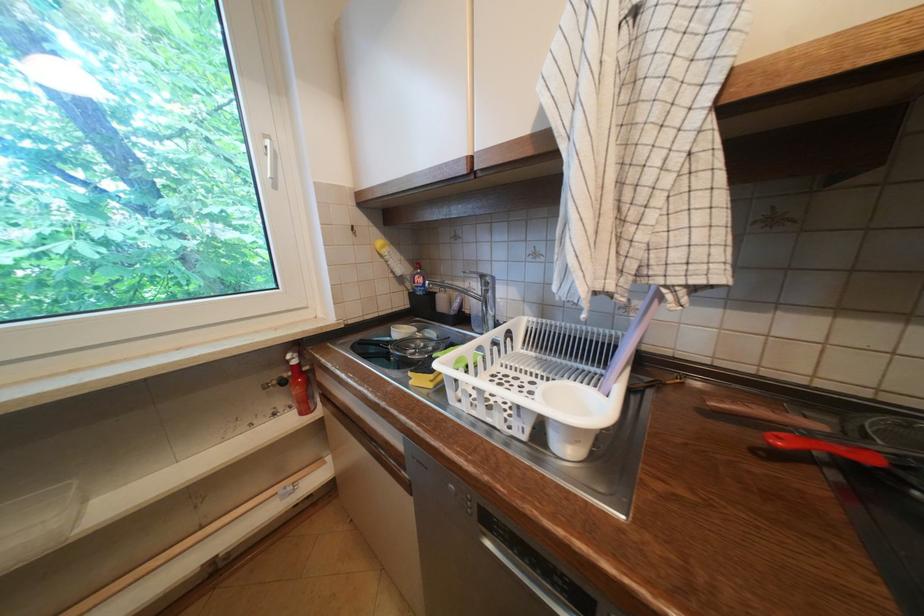
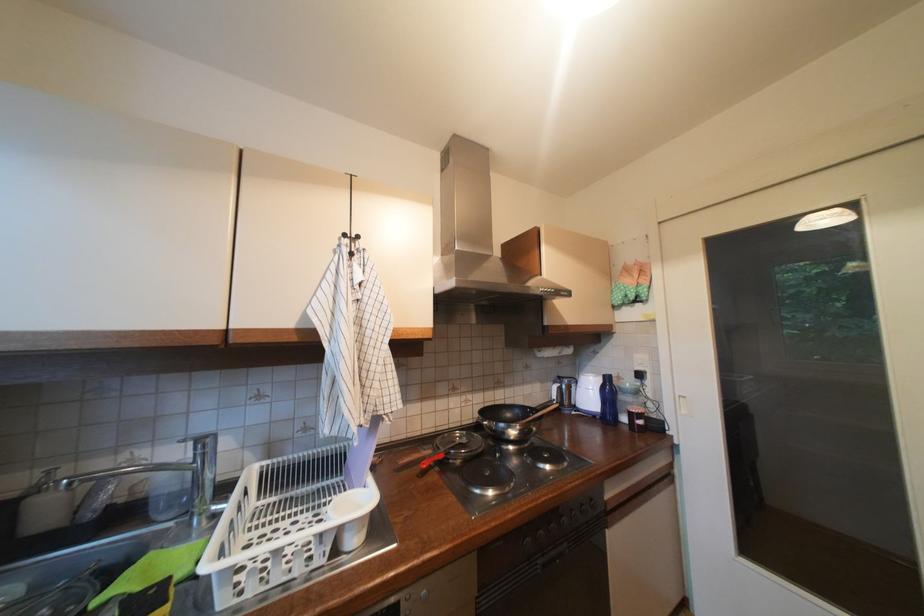
Question: How did the camera likely rotate?

Choices:
 (A) Left
 (B) Right
 (C) Up
 (D) Down

Answer: (B)